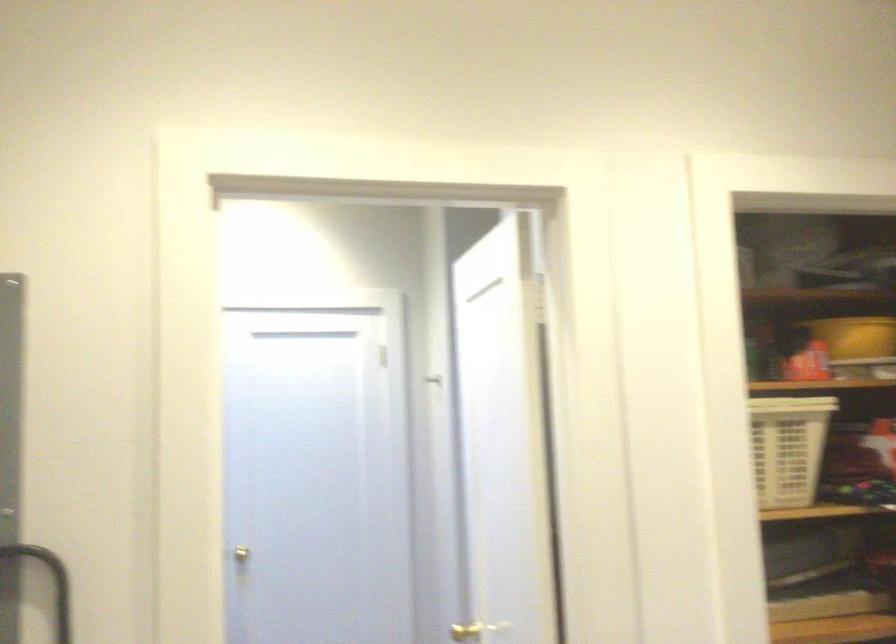
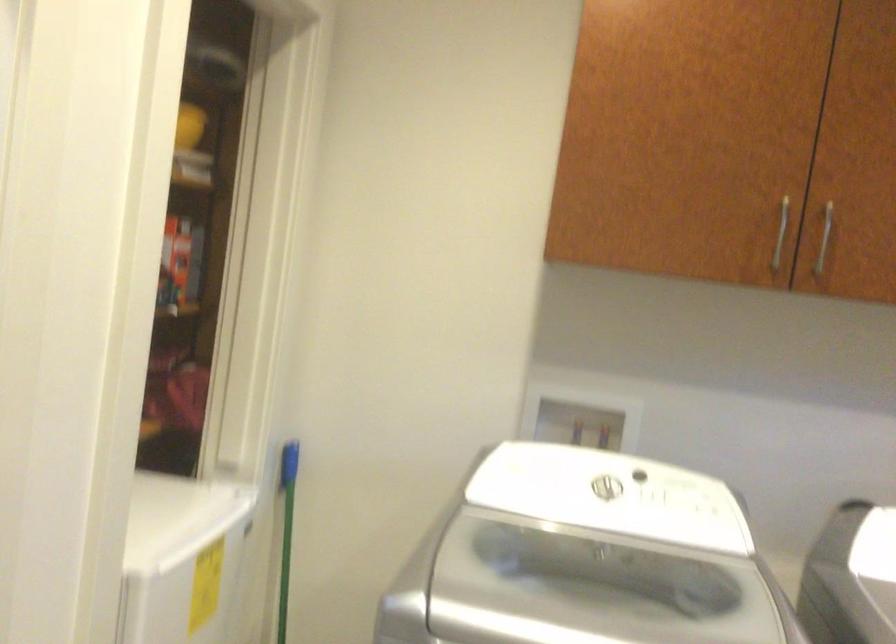
Question: The camera is either moving clockwise (left) or counter-clockwise (right) around the object. The first image is from the beginning of the video and the second image is from the end. Is the camera moving left or right when shooting the video?

Choices:
 (A) Left
 (B) Right

Answer: (A)